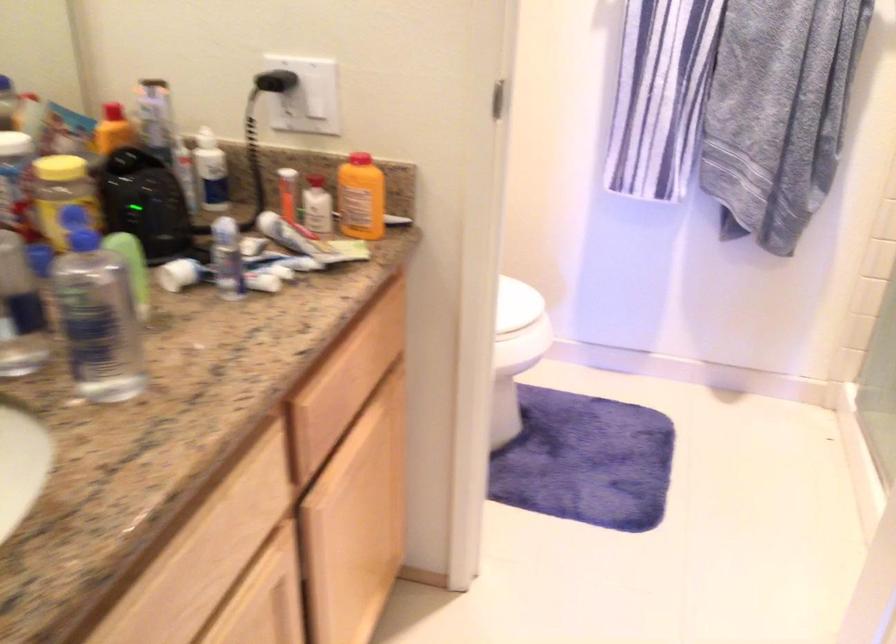
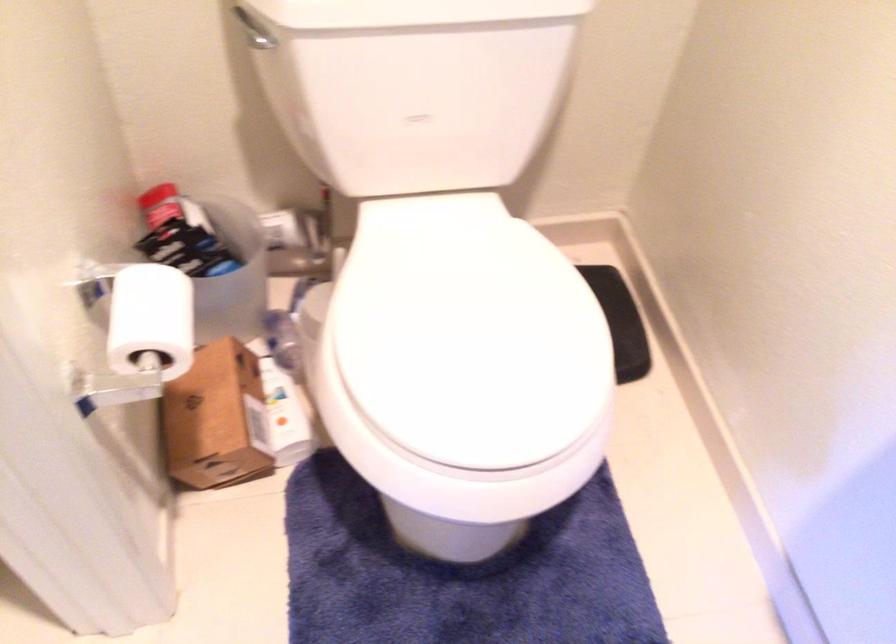
Locate, in the second image, the point that corresponds to point 438,310 in the first image.

(151, 319)